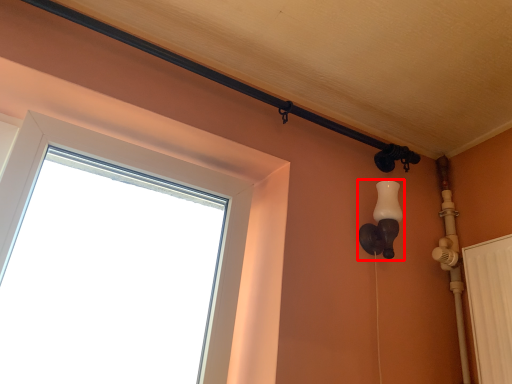
Question: From the image's perspective, what is the correct spatial relationship of light fixture (annotated by the red box) in relation to window?

Choices:
 (A) above
 (B) below

Answer: (B)